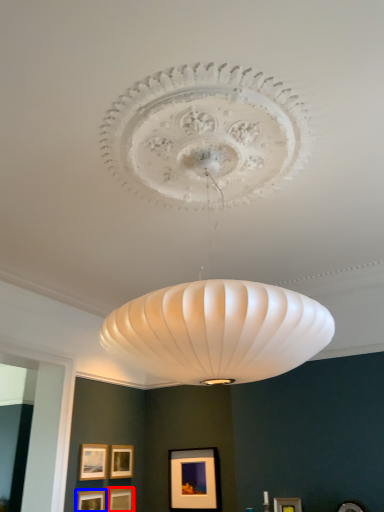
Question: Which of the following is the farthest to the observer, picture frame (highlighted by a red box) or picture frame (highlighted by a blue box)?

Choices:
 (A) picture frame
 (B) picture frame

Answer: (A)